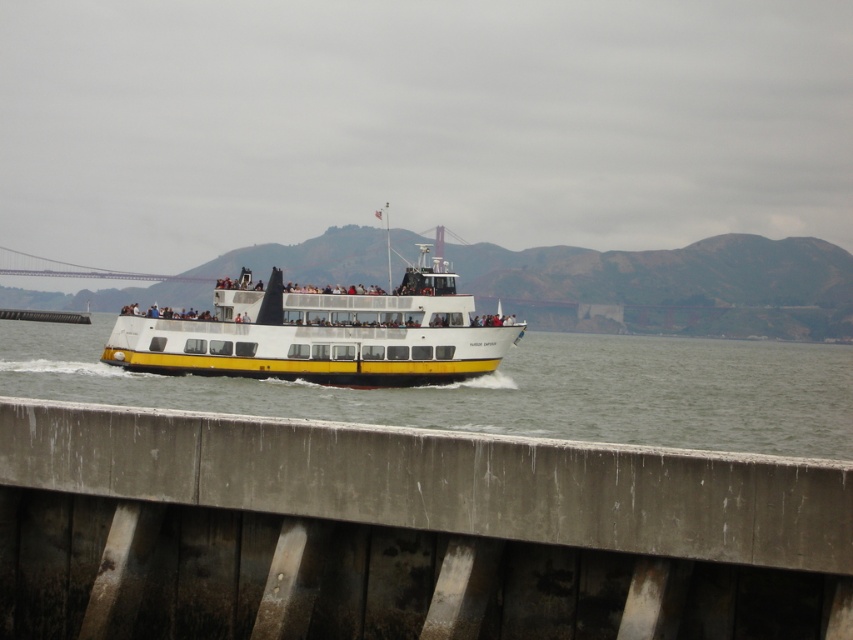
Does metallic gray bridge at center have a greater height compared to white matte water at center?

Incorrect, metallic gray bridge at center's height is not larger of white matte water at center's.

Between metallic gray bridge at center and white matte water at center, which one appears on the right side from the viewer's perspective?

Positioned to the right is metallic gray bridge at center.

You are a GUI agent. You are given a task and a screenshot of the screen. Output one action in this format:
    pyautogui.click(x=<x>, y=<y>)
    Task: Click on the metallic gray bridge at center
    Image resolution: width=853 pixels, height=640 pixels.
    Given the screenshot: What is the action you would take?
    pyautogui.click(x=402, y=532)

Between white matte water at center and white/yellow ferry at center, which one appears on the right side from the viewer's perspective?

From the viewer's perspective, white/yellow ferry at center appears more on the right side.

Does white matte water at center have a lesser width compared to white/yellow ferry at center?

In fact, white matte water at center might be wider than white/yellow ferry at center.

Is point (590, 406) less distant than point (213, 364)?

Yes, it is.

Identify the location of white matte water at center. (506, 388).

Can you confirm if metallic gray bridge at center is thinner than white/yellow ferry at center?

Correct, metallic gray bridge at center's width is less than white/yellow ferry at center's.

Is metallic gray bridge at center above white/yellow ferry at center?

No.

Is point (566, 500) more distant than point (302, 352)?

No, it is in front of (302, 352).

This screenshot has height=640, width=853. I want to click on metallic gray bridge at center, so click(x=402, y=532).